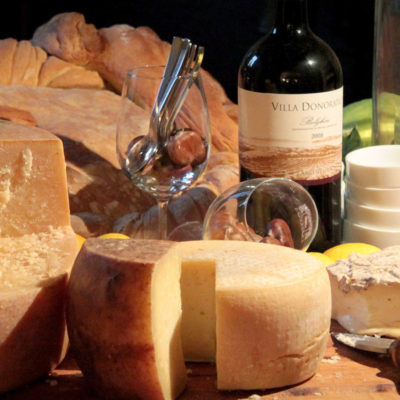
The width and height of the screenshot is (400, 400). Find the location of `bowl`. bowl is located at coordinates (394, 195).